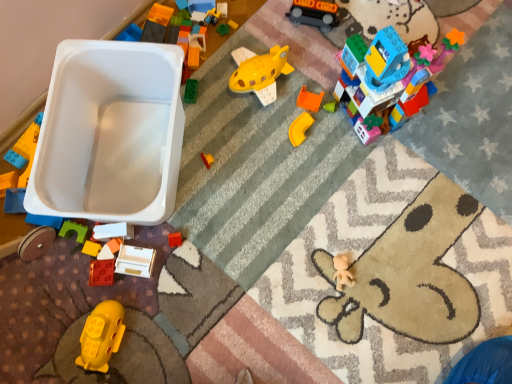
Locate an element on the screen. This screenshot has width=512, height=384. free space in front of rubber brick at lower left, the 7th toy positioned from the top is located at coordinates (78, 338).